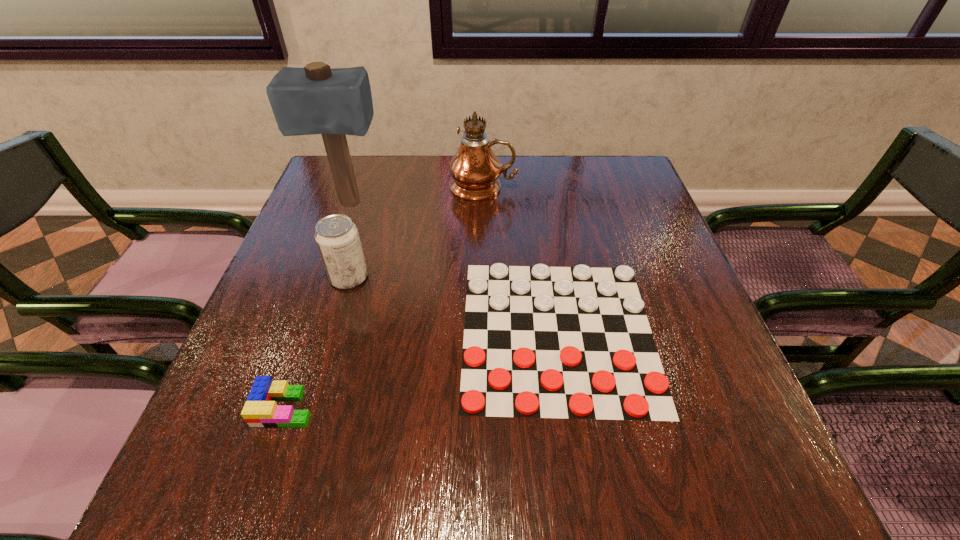
Select which object is the third closest to the soda can. Please provide its 2D coordinates. Your answer should be formatted as a tuple, i.e. [(x, y)], where the tuple contains the x and y coordinates of a point satisfying the conditions above.

[(260, 410)]

Where is `vacant area that satisfies the following two spatial constraints: 1. on the back side of the oil lamp; 2. on the right side of the Lego`? The height and width of the screenshot is (540, 960). vacant area that satisfies the following two spatial constraints: 1. on the back side of the oil lamp; 2. on the right side of the Lego is located at coordinates (360, 187).

Locate an element on the screen. Image resolution: width=960 pixels, height=540 pixels. free space that satisfies the following two spatial constraints: 1. on the front side of the fourth tallest object; 2. on the left side of the mallet is located at coordinates (277, 408).